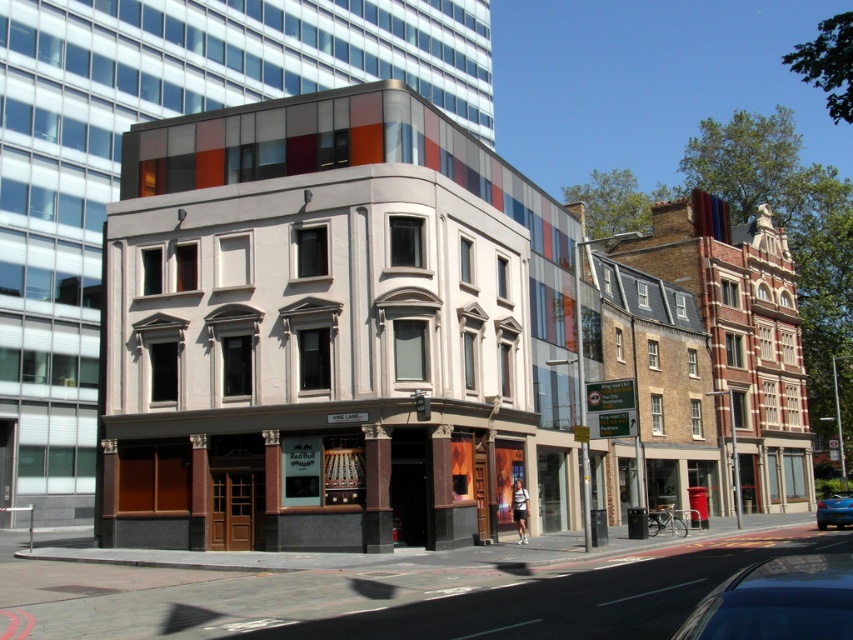
Is metallic blue car at center above blue glossy sedan at lower right?

Correct, metallic blue car at center is located above blue glossy sedan at lower right.

Measure the distance between metallic blue car at center and blue glossy sedan at lower right.

metallic blue car at center and blue glossy sedan at lower right are 80.21 feet apart from each other.

Who is more distant from viewer, (759, 576) or (827, 502)?

The point (827, 502) is more distant.

You are a GUI agent. You are given a task and a screenshot of the screen. Output one action in this format:
    pyautogui.click(x=<x>, y=<y>)
    Task: Click on the metallic blue car at center
    The height and width of the screenshot is (640, 853).
    Given the screenshot: What is the action you would take?
    pyautogui.click(x=778, y=602)